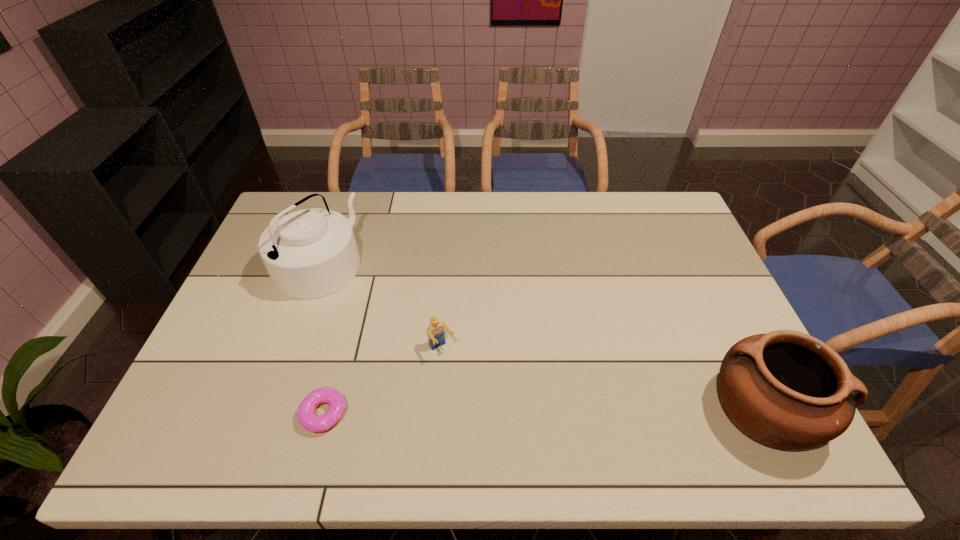
You are a GUI agent. You are given a task and a screenshot of the screen. Output one action in this format:
    pyautogui.click(x=<x>, y=<y>)
    Task: Click on the unoccupied position between the pottery and the second object from right to left
    
    Given the screenshot: What is the action you would take?
    tap(602, 379)

Where is `vacant space that's between the shortest object and the second shortest object`? vacant space that's between the shortest object and the second shortest object is located at coordinates (383, 381).

Locate an element on the screen. free space that is in between the tallest object and the Lego is located at coordinates (380, 307).

What are the coordinates of `free space that is in between the shortest object and the third tallest object` in the screenshot? It's located at (383, 381).

This screenshot has height=540, width=960. I want to click on free area in between the third tallest object and the doughnut, so click(383, 381).

At what (x,y) coordinates should I click in order to perform the action: click on free spot between the kettle and the third tallest object. Please return your answer as a coordinate pair (x, y). The image size is (960, 540). Looking at the image, I should click on (380, 307).

I want to click on vacant space in between the doughnut and the Lego, so click(x=383, y=381).

Image resolution: width=960 pixels, height=540 pixels. Find the location of `the third closest object to the rightmost object`. the third closest object to the rightmost object is located at coordinates (310, 253).

I want to click on object that is the closest to the rightmost object, so click(x=436, y=335).

Locate an element on the screen. This screenshot has width=960, height=540. vacant region that satisfies the following two spatial constraints: 1. on the front side of the third object from left to right; 2. on the left side of the second tallest object is located at coordinates (438, 408).